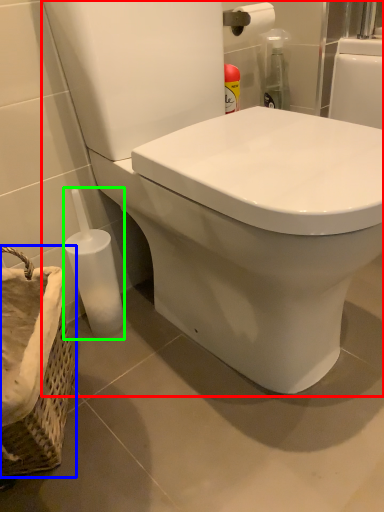
Question: Based on their relative distances, which object is farther from toilet (highlighted by a red box)? Choose from basket container (highlighted by a blue box) and bottle (highlighted by a green box).

Choices:
 (A) basket container
 (B) bottle

Answer: (A)